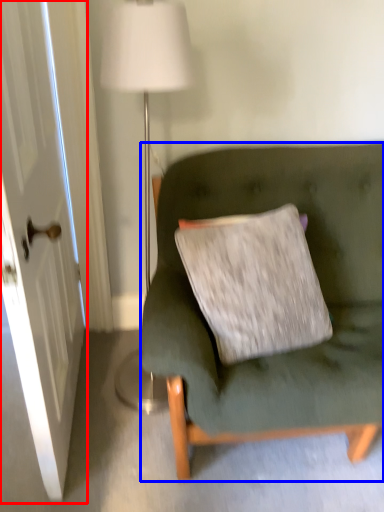
Question: Which point is further to the camera, door (highlighted by a red box) or studio couch (highlighted by a blue box)?

Choices:
 (A) door
 (B) studio couch

Answer: (B)